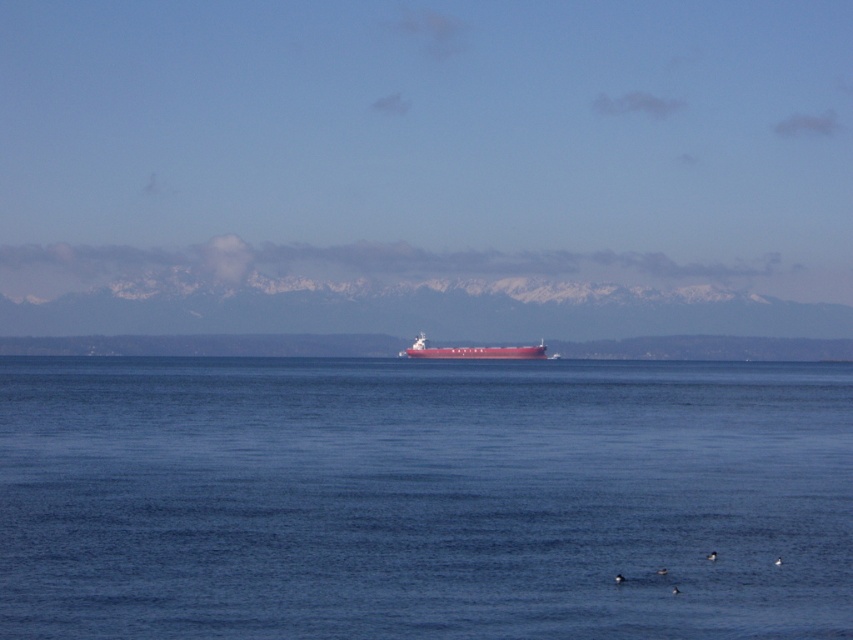
Can you confirm if blue smooth water at center is thinner than matte red ship at center?

Incorrect, blue smooth water at center's width is not less than matte red ship at center's.

Between blue smooth water at center and matte red ship at center, which one appears on the right side from the viewer's perspective?

blue smooth water at center is more to the right.

Is point (375, 404) more distant than point (532, 353)?

No, (375, 404) is closer to viewer.

Find the location of `blue smooth water at center`. blue smooth water at center is located at coordinates (422, 499).